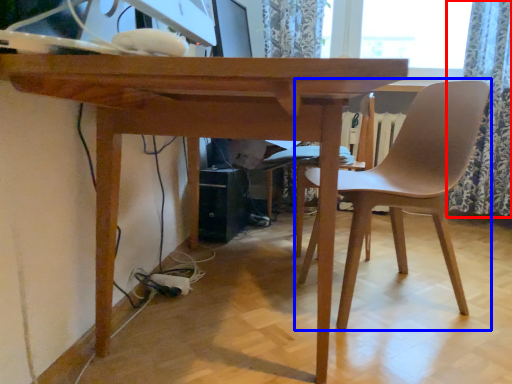
Question: Which object is closer to the camera taking this photo, curtain (highlighted by a red box) or chair (highlighted by a blue box)?

Choices:
 (A) curtain
 (B) chair

Answer: (B)